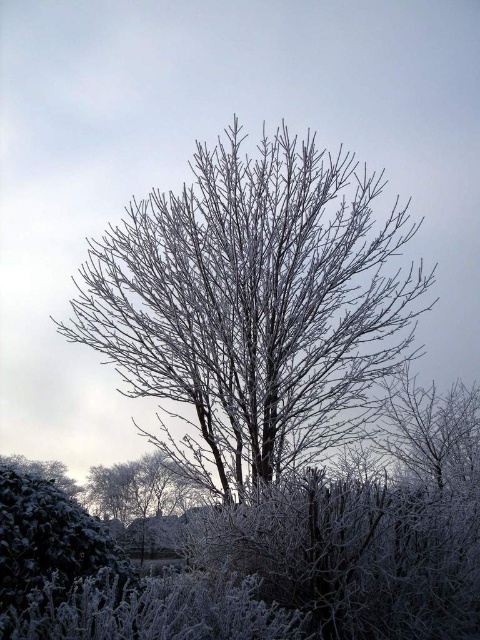
You are an artist sketching the winter scene. You need to decide which object to draw first based on their sizes. Which one should you start with, the frosted branches at center or the green matte bush at lower left?

The frosted branches at center is bigger than the green matte bush at lower left, so you should start with the frosted branches at center to ensure proper scaling and placement in your sketch.

You are standing in the winter scene and want to take a photo of both the frosted branches at center and the green matte bush at lower left. The camera you have can focus on objects within a 3 meter range. Will you be able to capture both in focus?

The frosted branches at center is 3.64 meters away from green matte bush at lower left. Since the distance between them exceeds the camera focus range of 3 meters, you cannot capture both in focus at the same time.

You are a photographer standing at the center of the winter scene. You want to capture both the frosty tree branches at point [213,333] and the distant landscape at point [52,561] in a single photo. Which point should you focus on first to ensure both are in sharp focus?

You should focus on point [52,561] first because it is closer to you than point [213,333]. By focusing on the closer point, the depth of field may extend to include the farther point in sharp focus.